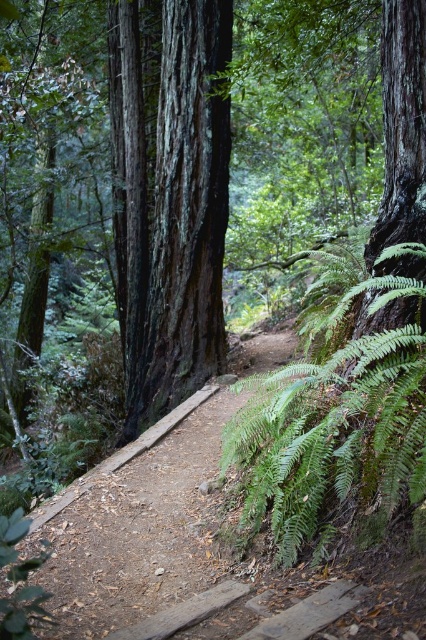
From the picture: You are a hiker standing at the trailhead and want to reach the dark brown textured bark at center. Based on the coordinates provided, which direction should you walk to reach it?

The dark brown textured bark at center is located at coordinates point (172, 204), so you should walk towards the center of the scene to reach it.

You are a hiker carrying a large backpack and want to pass through the dirt path at center. There is a green leafy fern at right nearby. Considering their widths, will the fern block your path?

The green leafy fern at right has a lesser width compared to dirt path at center, so it will not block your path since it is narrower than the path itself.